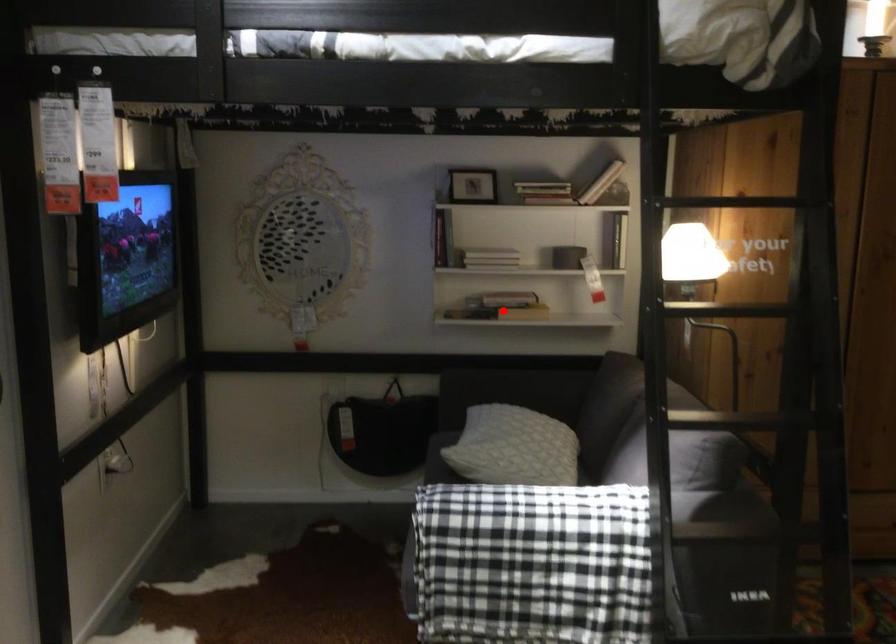
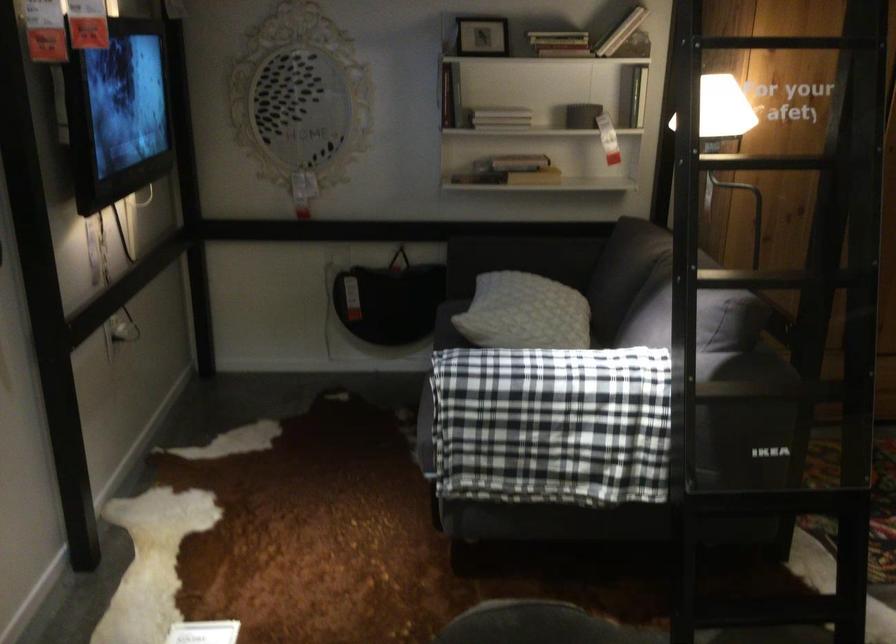
In the second image, find the point that corresponds to the highlighted location in the first image.

(509, 171)